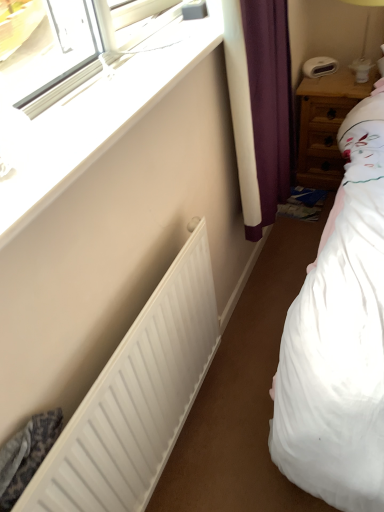
Question: Is white plastic bedside lamp at upper right taller or shorter than white matte radiator at lower left?

Choices:
 (A) tall
 (B) short

Answer: (B)

Question: Do you think white plastic bedside lamp at upper right is within white matte radiator at lower left, or outside of it?

Choices:
 (A) outside
 (B) inside

Answer: (A)

Question: Which is farther from the white matte radiator at lower left?

Choices:
 (A) white plastic window at upper left
 (B) wooden nightstand at right
 (C) white plastic bedside lamp at upper right

Answer: (C)

Question: Which object is the closest to the white plastic bedside lamp at upper right?

Choices:
 (A) white plastic window at upper left
 (B) wooden nightstand at right
 (C) white matte radiator at lower left

Answer: (B)